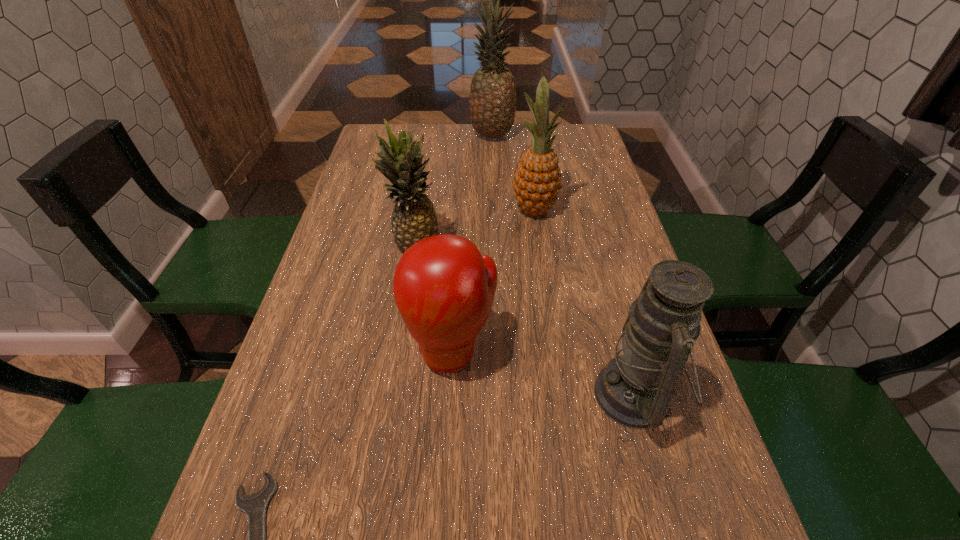
What are the coordinates of `the farthest pineapple` in the screenshot? It's located at tap(492, 104).

Identify the location of the tallest object. (492, 104).

This screenshot has height=540, width=960. What are the coordinates of `the second nearest pineapple` in the screenshot? It's located at (537, 182).

This screenshot has width=960, height=540. Identify the location of the leftmost pineapple. (413, 218).

At what (x,y) coordinates should I click in order to perform the action: click on the third farthest object. Please return your answer as a coordinate pair (x, y). This screenshot has height=540, width=960. Looking at the image, I should click on (413, 218).

Image resolution: width=960 pixels, height=540 pixels. I want to click on oil lamp, so (x=635, y=389).

Image resolution: width=960 pixels, height=540 pixels. Identify the location of boxing glove. (444, 289).

This screenshot has height=540, width=960. In order to click on vacant space located 0.150m on the left of the tallest object in this screenshot , I will do `click(425, 136)`.

Find the location of a particular element. free point located on the left of the second nearest pineapple is located at coordinates (481, 210).

This screenshot has height=540, width=960. I want to click on free space located 0.370m on the front of the leftmost pineapple, so click(x=390, y=407).